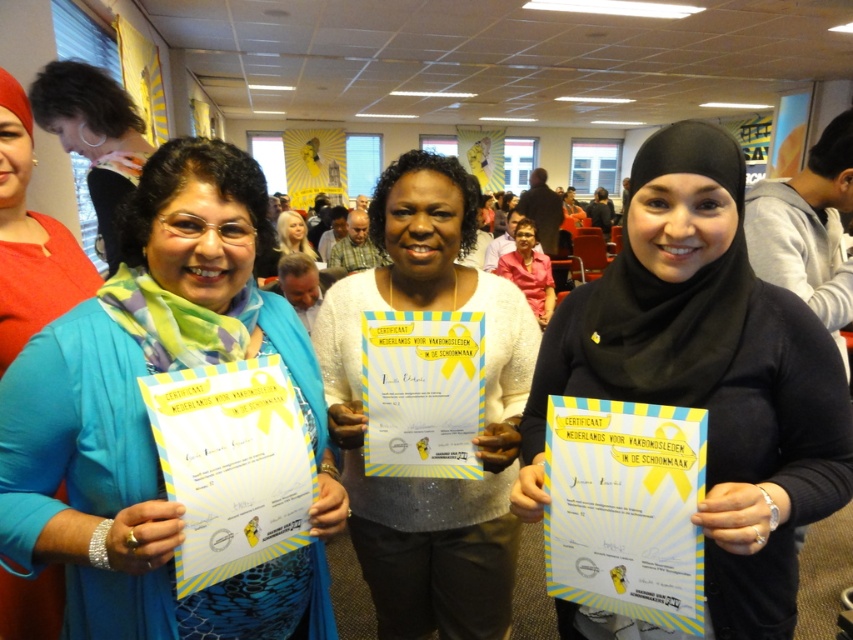
Is pink fabric shirt at center wider than blonde hair at center?

In fact, pink fabric shirt at center might be narrower than blonde hair at center.

Between point (526, 227) and point (299, 221), which one is positioned behind?

Point (299, 221)

The height and width of the screenshot is (640, 853). I want to click on pink fabric shirt at center, so click(x=529, y=269).

Who is shorter, blue fabric scarf at left or pink fabric shirt at center?

pink fabric shirt at center

Between blue fabric scarf at left and pink fabric shirt at center, which one has more height?

Standing taller between the two is blue fabric scarf at left.

This screenshot has width=853, height=640. What are the coordinates of `blue fabric scarf at left` in the screenshot? It's located at (122, 496).

Does blue fabric scarf at left have a smaller size compared to matte black hijab at center?

Correct, blue fabric scarf at left occupies less space than matte black hijab at center.

Who is positioned more to the right, blue fabric scarf at left or matte black hijab at center?

From the viewer's perspective, matte black hijab at center appears more on the right side.

You are a GUI agent. You are given a task and a screenshot of the screen. Output one action in this format:
    pyautogui.click(x=<x>, y=<y>)
    Task: Click on the blue fabric scarf at left
    This screenshot has width=853, height=640.
    Given the screenshot: What is the action you would take?
    pyautogui.click(x=122, y=496)

Identify the location of blue fabric scarf at left. (122, 496).